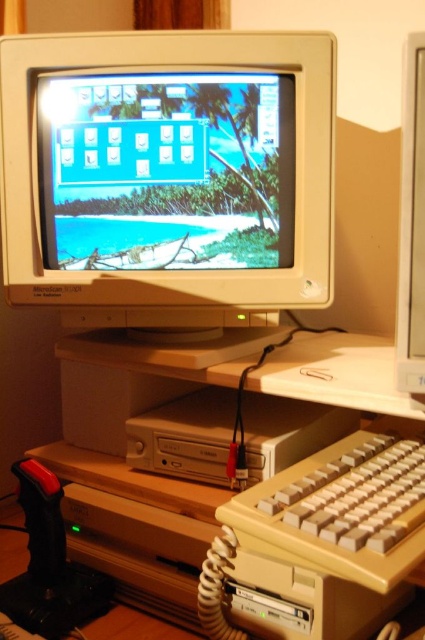
Does point (308, 195) lie in front of point (127, 454)?

Yes, it is.

Is point (212, 138) farther from camera compared to point (193, 413)?

That is False.

Is point (85, 214) more distant than point (175, 432)?

Yes, point (85, 214) is behind point (175, 432).

I want to click on matte plastic monitor at center, so click(167, 173).

Who is shorter, beige plastic keyboard at lower center or matte plastic monitor at right?

With less height is beige plastic keyboard at lower center.

Can you confirm if beige plastic keyboard at lower center is positioned above matte plastic monitor at right?

Incorrect, beige plastic keyboard at lower center is not positioned above matte plastic monitor at right.

The width and height of the screenshot is (425, 640). I want to click on beige plastic keyboard at lower center, so click(x=342, y=509).

Where is `beige plastic keyboard at lower center`? beige plastic keyboard at lower center is located at coordinates (342, 509).

Does white plastic cd-rom drive at center have a smaller size compared to matte plastic monitor at right?

Incorrect, white plastic cd-rom drive at center is not smaller in size than matte plastic monitor at right.

Does white plastic cd-rom drive at center have a lesser height compared to matte plastic monitor at right?

Indeed, white plastic cd-rom drive at center has a lesser height compared to matte plastic monitor at right.

Which is in front, point (187, 406) or point (414, 106)?

Point (414, 106) is more forward.

Where is `white plastic cd-rom drive at center`? This screenshot has width=425, height=640. white plastic cd-rom drive at center is located at coordinates (184, 436).